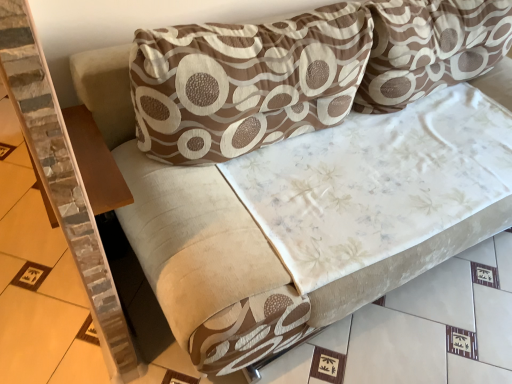
Question: Is brown printed cushion at upper center, arranged as the 2th pillow when viewed from the right, to the left or to the right of brown wood table at left in the image?

Choices:
 (A) right
 (B) left

Answer: (A)

Question: From the image's perspective, is brown printed cushion at upper center, positioned as the 1th pillow in left-to-right order, above or below brown wood table at left?

Choices:
 (A) above
 (B) below

Answer: (A)

Question: Which object is the closest to the brown printed fabric pillow at upper center, the first pillow viewed from the right?

Choices:
 (A) brown printed cushion at upper center, positioned as the 1th pillow in left-to-right order
 (B) brown wood table at left

Answer: (A)

Question: Which object is the farthest from the brown printed cushion at upper center, positioned as the 1th pillow in left-to-right order?

Choices:
 (A) brown printed fabric pillow at upper center, positioned as the second pillow in left-to-right order
 (B) brown wood table at left

Answer: (B)